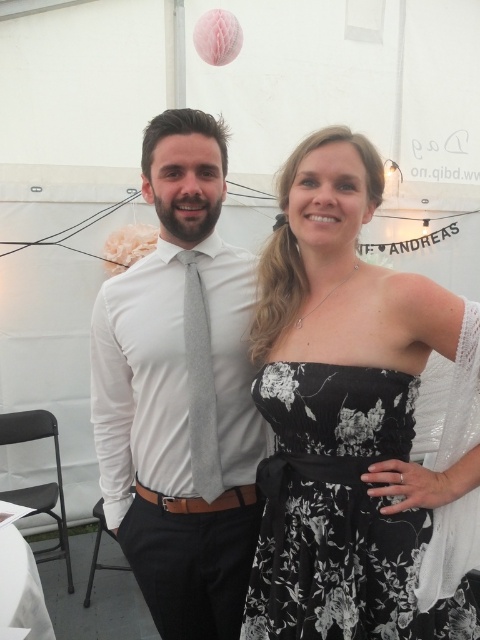
You are organizing a photo shoot and need to ensure that both the black floral dress at center and the gray textured tie at center can fit within a 1.2 meter wide frame. Based on their sizes, will they both fit comfortably within the frame?

The black floral dress at center is wider than the gray textured tie at center. Since the dress is wider, and the total width required would depend on their combined or individual widths. However, the description only states the dress is larger than the tie but does not provide exact measurements. Without specific dimensions, it is uncertain if they both can fit within the 1.2 meter frame. Additional information about their exact widths is needed to determine this.

You are a photographer at a wedding reception. You need to capture a photo where both the black floral dress at center and the gray textured tie at center are clearly visible. Considering their heights, which one might you adjust the camera angle to focus on first?

The black floral dress at center is taller than the gray textured tie at center. To ensure both are clearly visible, you should focus on the black floral dress at center first, then adjust the angle slightly downward to include the gray textured tie at center.

What are the exact coordinates of the matte gray tie at center in the image?

The matte gray tie at center is located at coordinates point (180,394).